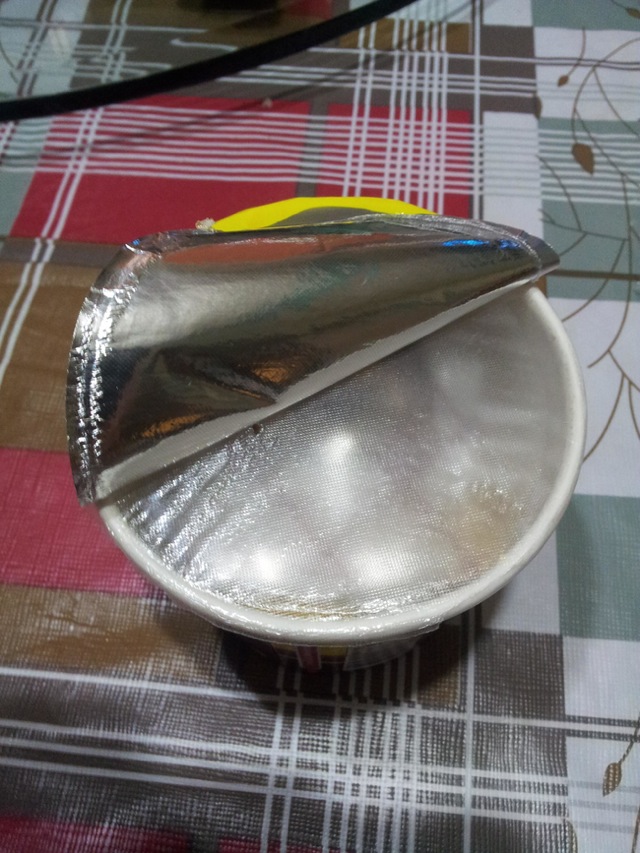
You are a GUI agent. You are given a task and a screenshot of the screen. Output one action in this format:
    pyautogui.click(x=<x>, y=<y>)
    Task: Click on the cardboard cup
    
    Given the screenshot: What is the action you would take?
    pyautogui.click(x=385, y=630)